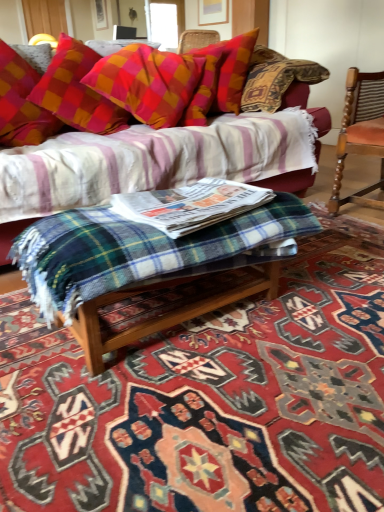
Question: From the image's perspective, is plaid fabric couch at upper center above or below green plaid blanket at center?

Choices:
 (A) below
 (B) above

Answer: (B)

Question: Relative to green plaid blanket at center, is plaid fabric couch at upper center in front or behind?

Choices:
 (A) front
 (B) behind

Answer: (B)

Question: Considering the real-world distances, which object is closest to the green plaid blanket at center?

Choices:
 (A) plaid fabric pillow at upper center
 (B) wooden chair with striped upholstery at right
 (C) plaid woolen blanket at center
 (D) plaid fabric couch at upper center

Answer: (C)

Question: Which object is the farthest from the green plaid blanket at center?

Choices:
 (A) plaid woolen blanket at center
 (B) plaid fabric pillow at upper center
 (C) wooden chair with striped upholstery at right
 (D) plaid fabric couch at upper center

Answer: (D)